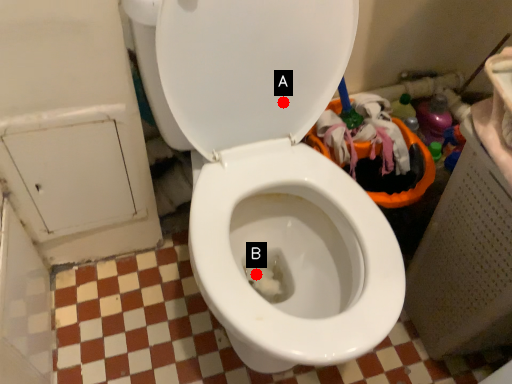
Question: Two points are circled on the image, labeled by A and B beside each circle. Which point appears farthest from the camera in this image?

Choices:
 (A) A is further
 (B) B is further

Answer: (B)